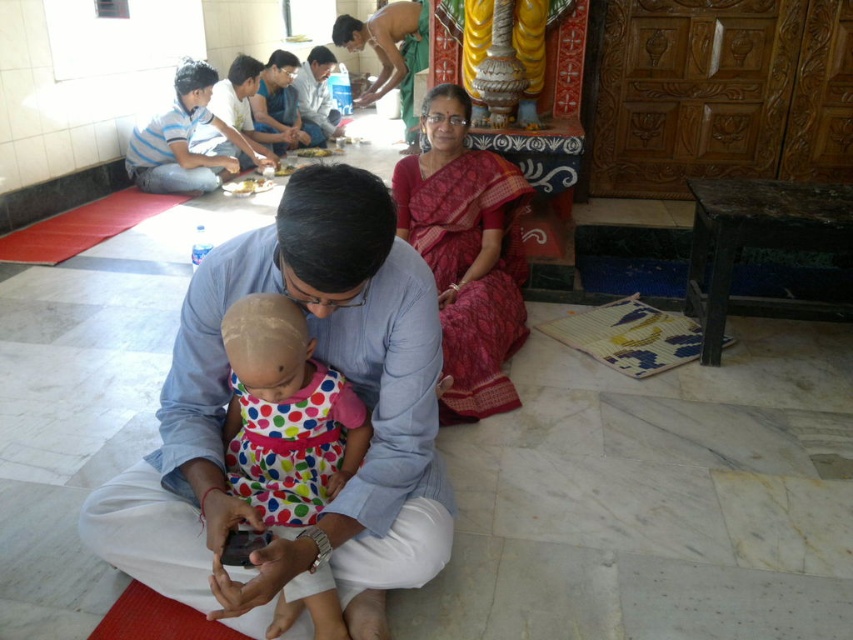
You are a photographer trying to capture the scene in front of you. You want to ensure that both the blue cotton shirt at center and the white matte food at center are clearly visible in your photo. Based on their positions, which object should you focus on first to ensure both are in frame?

Since the blue cotton shirt at center is to the right of the white matte food at center, you should focus on the white matte food at center first as it is closer to the left side, ensuring both objects remain in frame.

You are an assistant who needs to determine which clothing item is larger between the blue cotton shirt at center and the red silk saree at center. Based on the scene description, which one is bigger?

The red silk saree at center is larger than the blue cotton shirt at center according to the description provided.

Based on the photo, you are a photographer trying to capture the scene in the temple. You need to focus on the blue cotton shirt at center. Where exactly should you point your camera to capture it?

You should point your camera at point 0.569 on the x axis and 0.383 on the y axis to capture the blue cotton shirt at center.